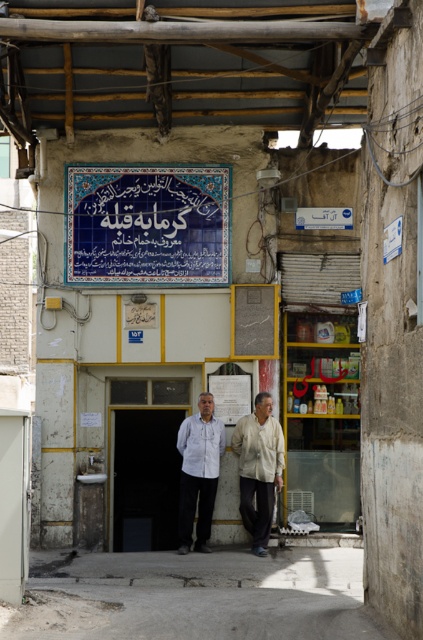
Question: Which object appears closest to the camera in this image?

Choices:
 (A) light beige fabric shirt at center
 (B) dusty concrete alley at lower center
 (C) blue tile signboard at upper center
 (D) dark wood door at center

Answer: (B)

Question: Among these points, which one is farthest from the camera?

Choices:
 (A) (32, 625)
 (B) (197, 538)
 (C) (101, 209)
 (D) (189, 433)

Answer: (C)

Question: Does light beige fabric shirt at center appear under white matte shirt at center?

Choices:
 (A) no
 (B) yes

Answer: (B)

Question: Which object is closer to the camera taking this photo?

Choices:
 (A) dusty concrete alley at lower center
 (B) light beige fabric shirt at center
 (C) white cotton shirt at center

Answer: (A)

Question: From the image, what is the correct spatial relationship of dusty concrete alley at lower center in relation to blue tile signboard at upper center?

Choices:
 (A) below
 (B) above

Answer: (A)

Question: From the image, what is the correct spatial relationship of dusty concrete alley at lower center in relation to light beige fabric shirt at center?

Choices:
 (A) above
 (B) below

Answer: (B)